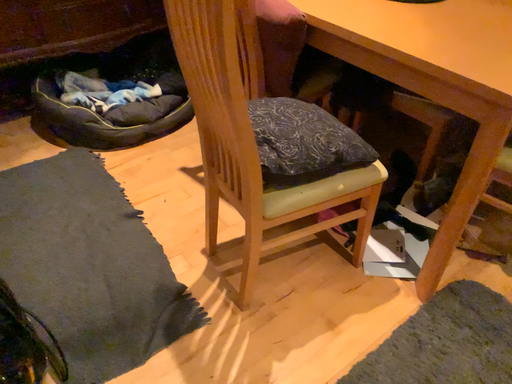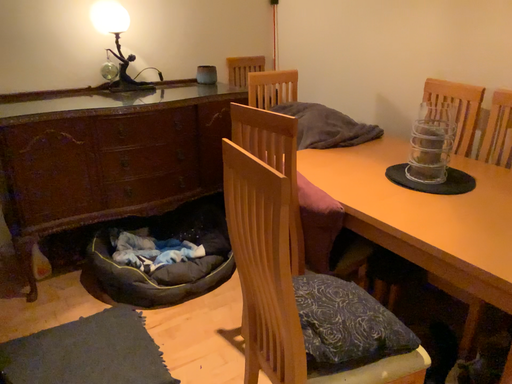
Question: Which way did the camera rotate in the video?

Choices:
 (A) rotated upward
 (B) rotated downward

Answer: (A)